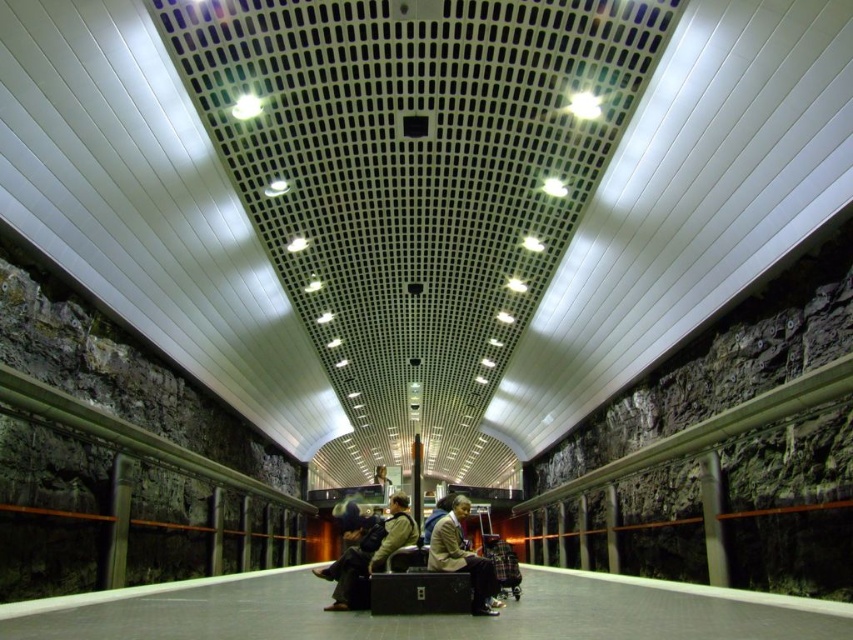
Question: Which point is farther to the camera?

Choices:
 (A) dark gray fabric jacket at center
 (B) tan leather jacket at center

Answer: (A)

Question: Can you confirm if dark gray fabric jacket at center is bigger than tan leather jacket at center?

Choices:
 (A) yes
 (B) no

Answer: (A)

Question: Does dark gray fabric jacket at center lie behind tan leather jacket at center?

Choices:
 (A) yes
 (B) no

Answer: (A)

Question: Which of the following is the closest to the observer?

Choices:
 (A) (340, 609)
 (B) (453, 499)

Answer: (A)

Question: Is the position of dark gray fabric jacket at center more distant than that of tan leather jacket at center?

Choices:
 (A) no
 (B) yes

Answer: (B)